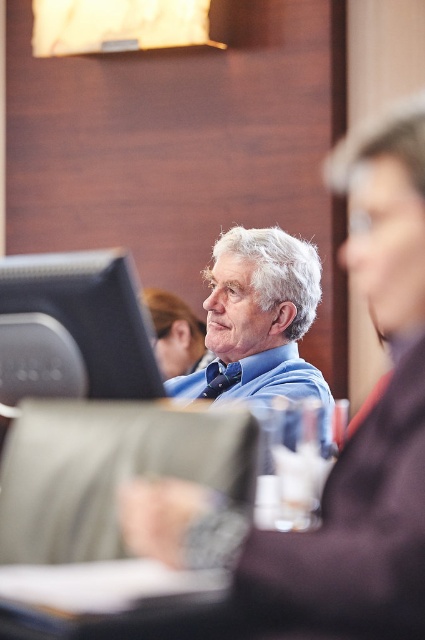
Does point (263, 260) come closer to viewer compared to point (206, 352)?

Yes, it is.

Is blue shirt at center to the right of matte black hair at upper center from the viewer's perspective?

Yes, blue shirt at center is to the right of matte black hair at upper center.

Identify the location of blue shirt at center. The height and width of the screenshot is (640, 425). 257,320.

I want to click on black glossy monitor at left, so click(73, 328).

Where is `black glossy monitor at left`? black glossy monitor at left is located at coordinates (73, 328).

Who is more forward, (8, 380) or (309, 310)?

Point (8, 380) is in front.

Where is `black glossy monitor at left`? The width and height of the screenshot is (425, 640). black glossy monitor at left is located at coordinates (73, 328).